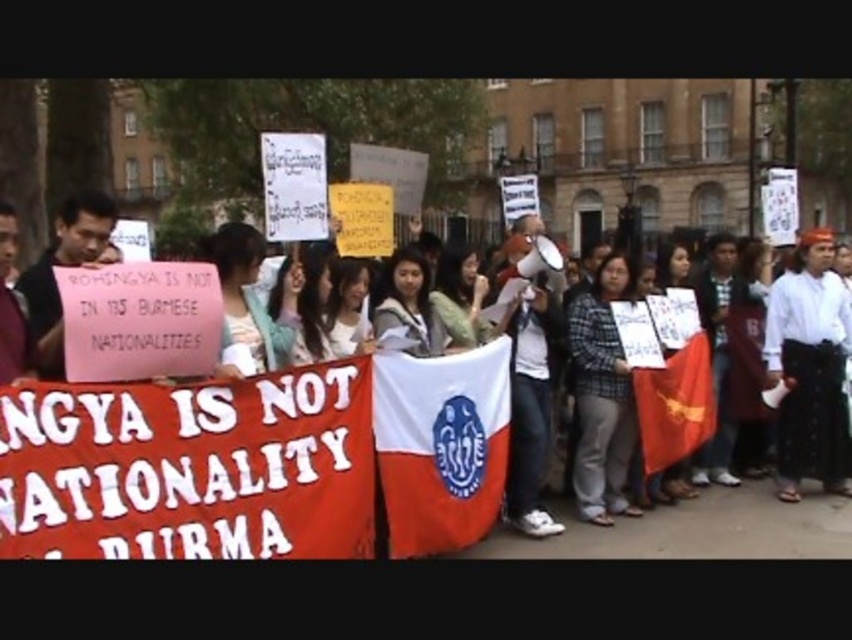
Question: Based on their relative distances, which object is farther from the white cotton shirt at center?

Choices:
 (A) plaid shirt at center
 (B) white fabric banner at center

Answer: (B)

Question: Which is nearer to the red fabric flag at center?

Choices:
 (A) white fabric flag at center
 (B) red fabric banner at center

Answer: (A)

Question: Is white fabric banner at center wider than white fabric flag at center?

Choices:
 (A) yes
 (B) no

Answer: (A)

Question: Is white fabric banner at center smaller than red fabric banner at center?

Choices:
 (A) yes
 (B) no

Answer: (B)

Question: Which of these objects is positioned farthest from the red fabric banner at center?

Choices:
 (A) white fabric flag at center
 (B) plaid shirt at center
 (C) red fabric flag at center

Answer: (C)

Question: Is the position of white fabric banner at center more distant than that of white cotton shirt at center?

Choices:
 (A) no
 (B) yes

Answer: (A)